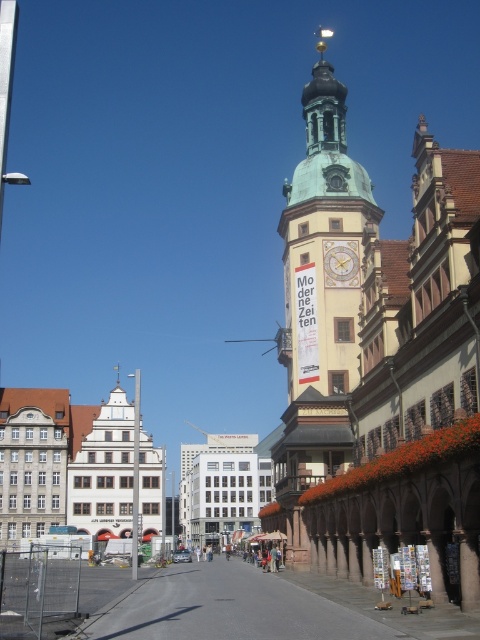
Question: Which point is farther to the camera?

Choices:
 (A) (360, 164)
 (B) (338, 264)

Answer: (A)

Question: Which object appears closest to the camera in this image?

Choices:
 (A) yellowish stone clock tower at center
 (B) gold metallic clock at center

Answer: (A)

Question: Can you confirm if yellowish stone clock tower at center is positioned above gold metallic clock at center?

Choices:
 (A) no
 (B) yes

Answer: (B)

Question: Is yellowish stone clock tower at center below gold metallic clock at center?

Choices:
 (A) no
 (B) yes

Answer: (A)

Question: From the image, what is the correct spatial relationship of yellowish stone clock tower at center in relation to gold metallic clock at center?

Choices:
 (A) left
 (B) right

Answer: (B)